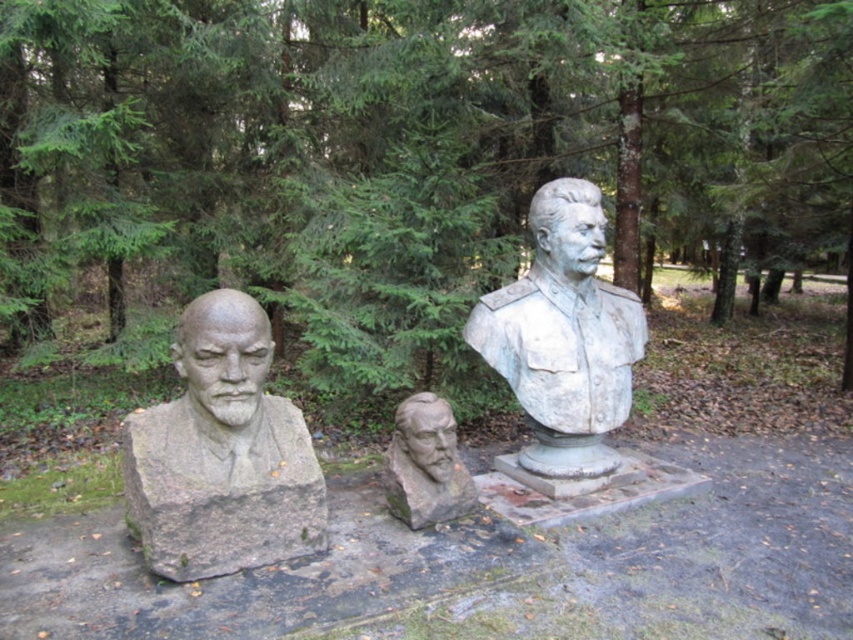
What is the location of the point with coordinates (222, 454) in the image?

The point with coordinates (222, 454) is located on the gray stone bust at left.

You are a park ranger who needs to locate the gray stone bust at left. According to the coordinates provided, where would you find it in the image?

The gray stone bust at left is located at point coordinates (222, 454).

You are a park ranger assessing the layout of the historical busts. Which of the two busts, the gray stone bust at left or the stone textured bust at center, is positioned higher in elevation?

The gray stone bust at left is positioned higher in elevation than the stone textured bust at center.